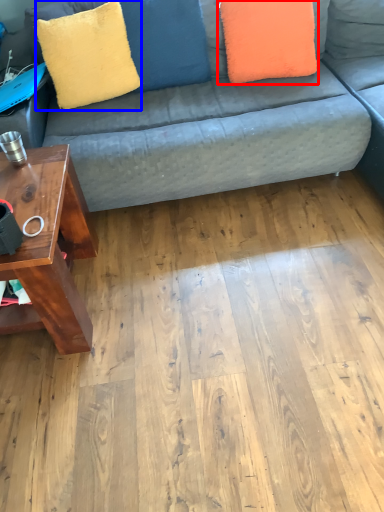
Question: Which point is further to the camera, pillow (highlighted by a red box) or throw pillow (highlighted by a blue box)?

Choices:
 (A) pillow
 (B) throw pillow

Answer: (A)